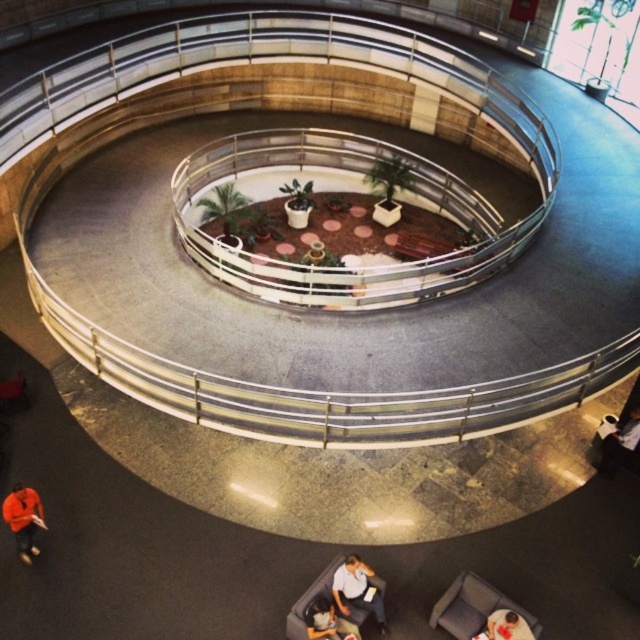
Can you confirm if white fabric shirt at lower center is shorter than dark gray fabric jacket at lower right?

No.

Who is positioned more to the left, white fabric shirt at lower center or dark gray fabric jacket at lower right?

white fabric shirt at lower center is more to the left.

Is point (353, 595) in front of point (621, 426)?

Yes, point (353, 595) is in front of point (621, 426).

Find the location of a particular element. white fabric shirt at lower center is located at coordinates (356, 589).

Between velvet blue couch at lower right and white fabric shirt at lower center, which one is positioned lower?

velvet blue couch at lower right

Can you confirm if velvet blue couch at lower right is positioned above white fabric shirt at lower center?

No, velvet blue couch at lower right is not above white fabric shirt at lower center.

Is point (509, 620) farther from camera compared to point (380, 624)?

No, (509, 620) is closer to viewer.

The image size is (640, 640). In order to click on velvet blue couch at lower right in this screenshot , I will do `click(481, 611)`.

Does orange sweater at lower left have a larger size compared to orange shirt at lower center?

Correct, orange sweater at lower left is larger in size than orange shirt at lower center.

Who is lower down, orange sweater at lower left or orange shirt at lower center?

Positioned lower is orange shirt at lower center.

Who is more distant from viewer, (x=32, y=544) or (x=353, y=628)?

The point (x=32, y=544) is behind.

At what (x,y) coordinates should I click in order to perform the action: click on orange sweater at lower left. Please return your answer as a coordinate pair (x, y). Looking at the image, I should click on (22, 518).